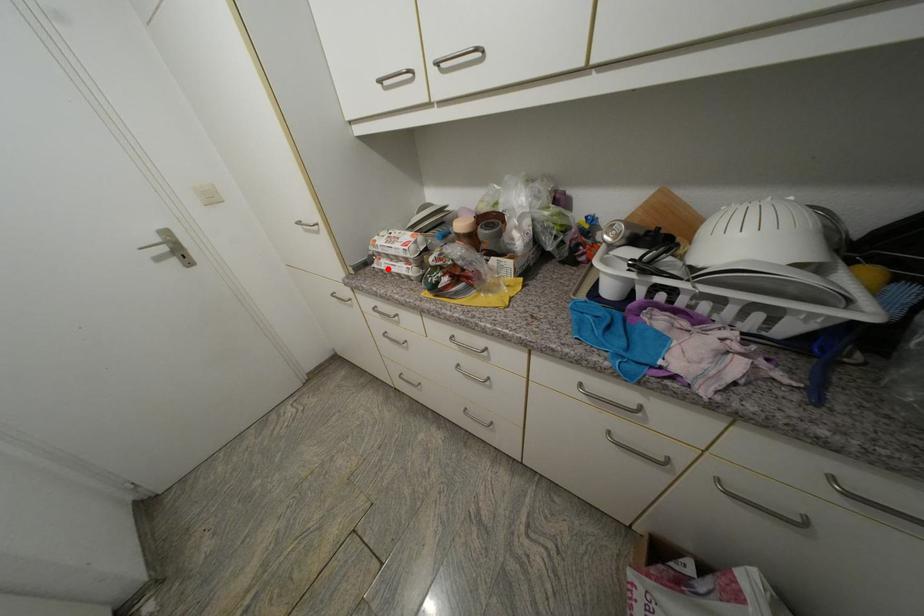
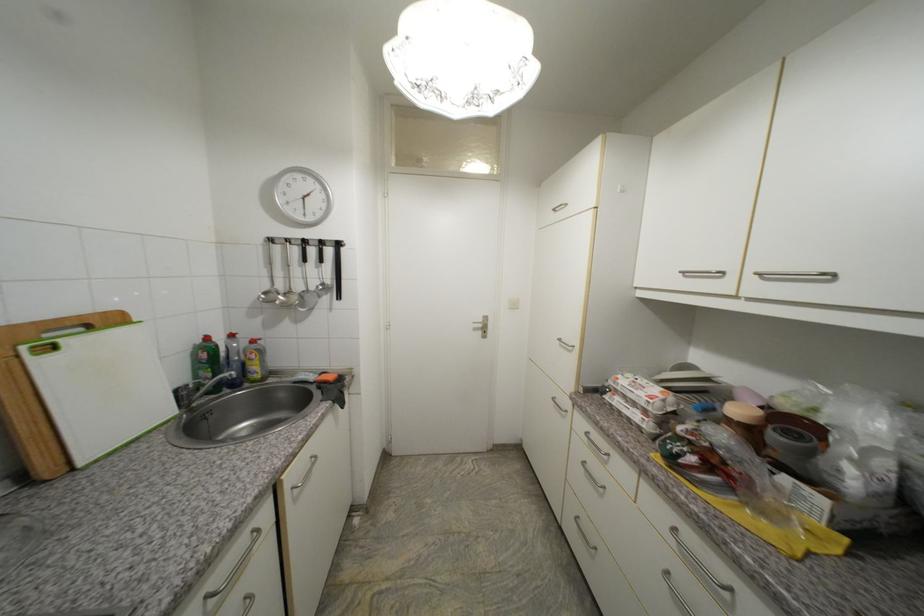
The point at the highlighted location is marked in the first image. Where is the corresponding point in the second image?

(619, 405)